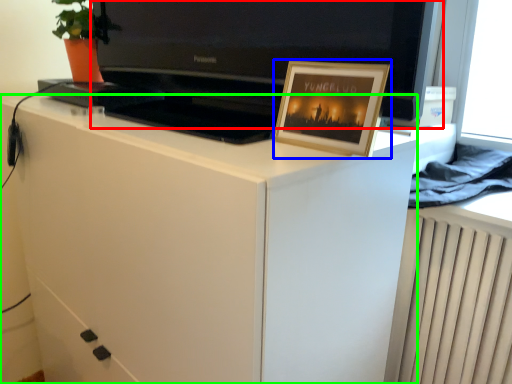
Question: Considering the real-world distances, which object is closest to television (highlighted by a red box)? picture frame (highlighted by a blue box) or cabinetry (highlighted by a green box).

Choices:
 (A) picture frame
 (B) cabinetry

Answer: (A)